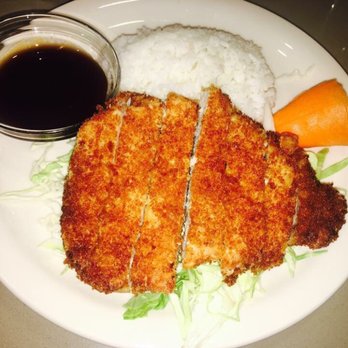
Where is `empty spot on left side of plate`? The width and height of the screenshot is (348, 348). empty spot on left side of plate is located at coordinates (19, 222).